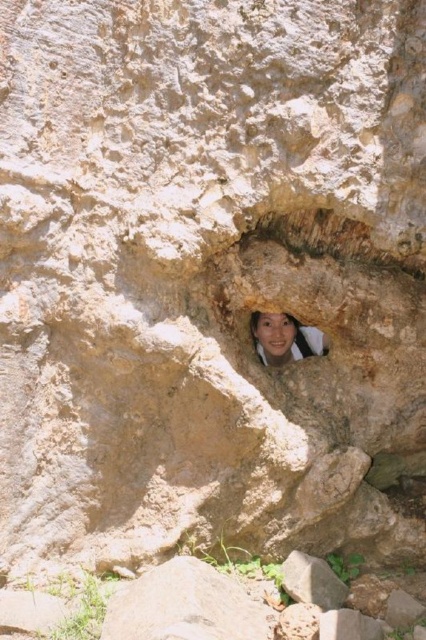
You are an artist trying to sketch this scene. You notice the smooth beige face at center and the gray rough rock at center. Which object should you draw first if you want to follow the rule of drawing larger objects before smaller ones?

The smooth beige face at center is larger in size than the gray rough rock at center, so you should draw the smooth beige face at center first.

You are an artist trying to sketch this scene. You notice the smooth beige face at center and the gray rough rock at center. Which object should you draw first if you want to follow the rule of drawing larger objects before smaller ones?

The smooth beige face at center has a greater height compared to the gray rough rock at center, so you should draw the smooth beige face at center first.

You are standing in front of a rock formation and see a smooth beige face at center and a gray rough rock at center. Which object is positioned higher in the scene?

The smooth beige face at center is located above the gray rough rock at center, so it is positioned higher in the scene.